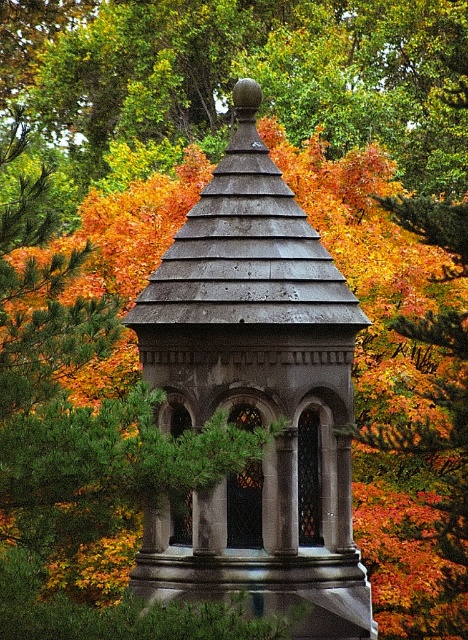
Question: Does gray stone gazebo at center appear on the left side of autumn leaves at center?

Choices:
 (A) no
 (B) yes

Answer: (B)

Question: Which point appears closest to the camera in this image?

Choices:
 (A) (250, 58)
 (B) (360, 592)

Answer: (B)

Question: Is gray stone gazebo at center smaller than autumn leaves at center?

Choices:
 (A) yes
 (B) no

Answer: (A)

Question: In this image, where is gray stone gazebo at center located relative to autumn leaves at center?

Choices:
 (A) below
 (B) above

Answer: (A)

Question: Which object appears farthest from the camera in this image?

Choices:
 (A) autumn leaves at center
 (B) gray stone gazebo at center

Answer: (A)